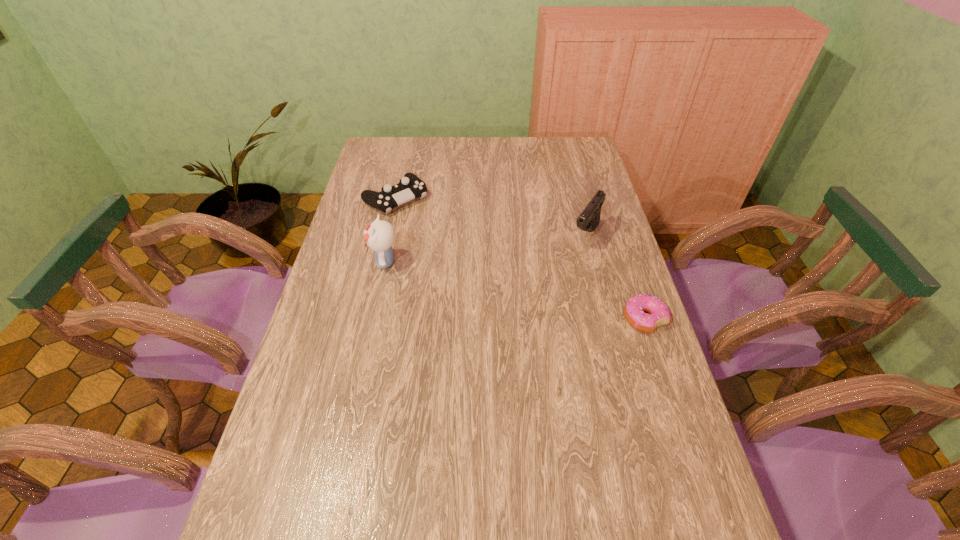
Where is `free spot between the nearest object and the pistol`? free spot between the nearest object and the pistol is located at coordinates (615, 277).

Identify the location of vacant region between the nearest object and the control. (520, 259).

Identify the location of empty space between the third shortest object and the kitten. The image size is (960, 540). (486, 248).

Identify the location of free point between the nearest object and the kitten. Image resolution: width=960 pixels, height=540 pixels. point(515,291).

Image resolution: width=960 pixels, height=540 pixels. In order to click on the second closest object to the third shortest object in this screenshot , I will do `click(410, 187)`.

Identify which object is the third nearest to the third shortest object. Please provide its 2D coordinates. Your answer should be formatted as a tuple, i.e. [(x, y)], where the tuple contains the x and y coordinates of a point satisfying the conditions above.

[(379, 236)]

What are the coordinates of `free space that satisfies the following two spatial constraints: 1. on the front side of the kitten; 2. on the front-facing side of the farthest object` in the screenshot? It's located at (381, 261).

Where is `vacant area in the image that satisfies the following two spatial constraints: 1. on the front side of the kitten; 2. on the front-facing side of the control`? vacant area in the image that satisfies the following two spatial constraints: 1. on the front side of the kitten; 2. on the front-facing side of the control is located at coordinates (381, 261).

This screenshot has width=960, height=540. I want to click on free point that satisfies the following two spatial constraints: 1. on the front side of the control; 2. on the left side of the second tallest object, so click(x=387, y=235).

At what (x,y) coordinates should I click in order to perform the action: click on free region that satisfies the following two spatial constraints: 1. on the front side of the doughnut; 2. on the left side of the farthest object. Please return your answer as a coordinate pair (x, y). This screenshot has width=960, height=540. Looking at the image, I should click on (369, 319).